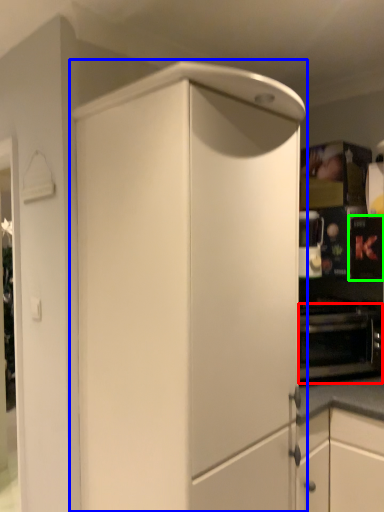
Question: Which object is positioned farthest from oven (highlighted by a red box)? Select from cabinetry (highlighted by a blue box) and appliance (highlighted by a green box).

Choices:
 (A) cabinetry
 (B) appliance

Answer: (A)